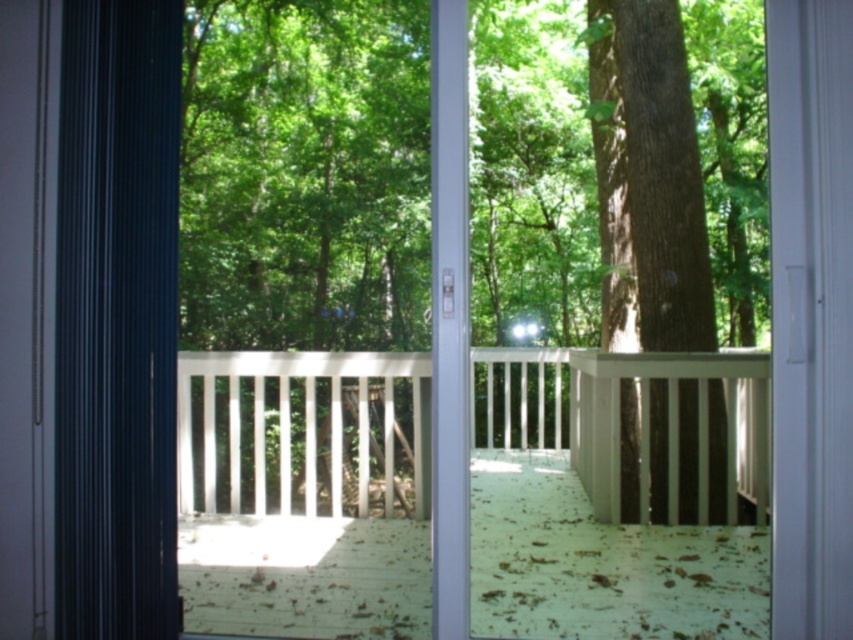
You are standing inside a house and looking through the sliding glass door. You see the black fabric curtain at left and the brown rough bark tree at center. Which object is closer to you?

The black fabric curtain at left is closer to you because it is in front of the brown rough bark tree at center.

You are planning to place a large outdoor dining set on the deck. Given the sizes of the white wooden porch at center and the brown rough bark tree at center, which area would be more suitable for the dining set?

The white wooden porch at center is larger in size than the brown rough bark tree at center, so the white wooden porch at center would be more suitable for placing the large outdoor dining set.